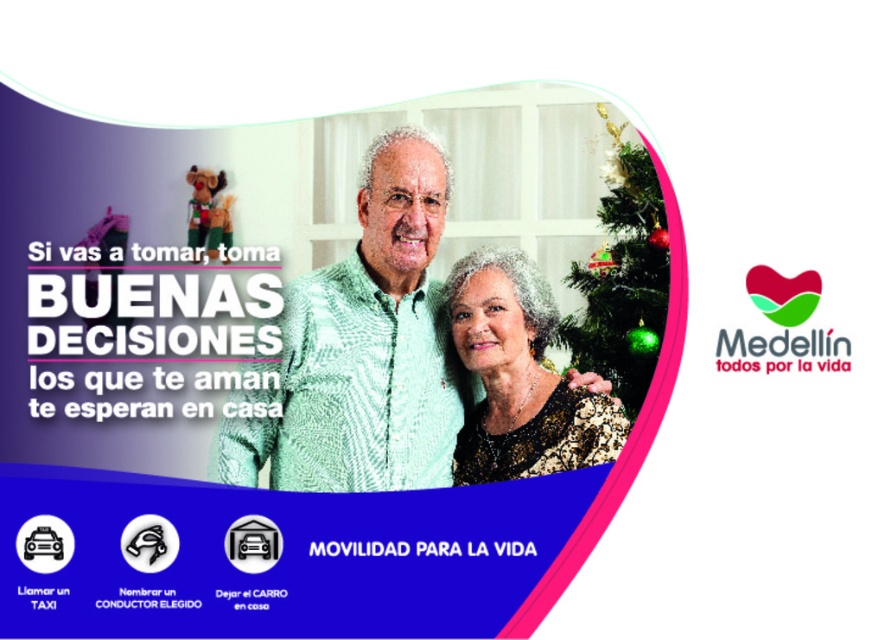
You are standing in front of the Christmas tree and want to place a decoration between the two points labeled point (344, 316) and point (597, 440). Which point is closer to you so that you can reach it easily?

Point (344, 316) is further to the camera than point (597, 440), so the closer point to you is point (597, 440). You should place the decoration near that point for easier reach.

In the advertisement, you see the green textured shirt at center and the green shiny ornaments at upper right. Which object is positioned to the left of the other?

The green textured shirt at center is to the left of the green shiny ornaments at upper right.

In the advertisement, there is a sparkly gold dress at center and green shiny ornaments at upper right. Which object is shorter in height?

The sparkly gold dress at center is shorter in height compared to the green shiny ornaments at upper right.